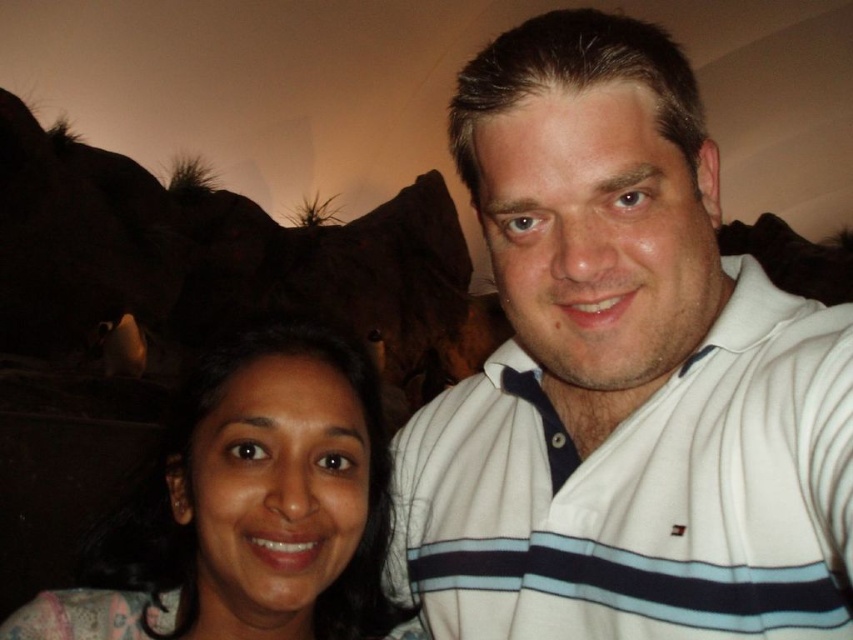
You are a photographer setting up a shoot in a dimly lit room with a rocky landscape backdrop. You have two outfits to photograph for a fashion catalog. The outfits are the white striped polo shirt at upper right and the matte floral dress at lower left. The camera you are using has a sensor that can only capture items wider than 15 inches. Based on the scene, can both outfits fit within the camera sensor when photographed individually?

The white striped polo shirt at upper right has a larger width than the matte floral dress at lower left. Since the polo shirt is wider, if it can fit within the 15 inch sensor, then the dress will also fit. However, if the polo shirt exceeds 15 inches, only the dress might fit. Without exact measurements, we can only compare their sizes relative to each other.

You are a photographer setting up a photo shoot in a room with a rocky landscape backdrop. You have two outfits to place on mannequins for a display. The outfits are the white striped polo shirt at upper right and the matte floral dress at lower left. Which outfit should you choose if you want the larger one to be placed on the mannequin closer to the camera?

The white striped polo shirt at upper right is bigger than the matte floral dress at lower left, so you should place the white striped polo shirt at upper right on the mannequin closer to the camera to make it appear larger in the photo.